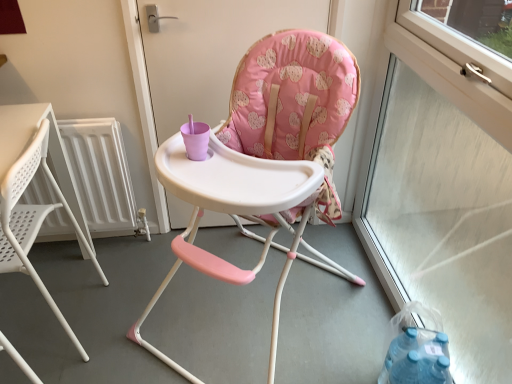
I want to click on free space to the right of white plastic chair at left, the first chair viewed from the left, so click(x=135, y=314).